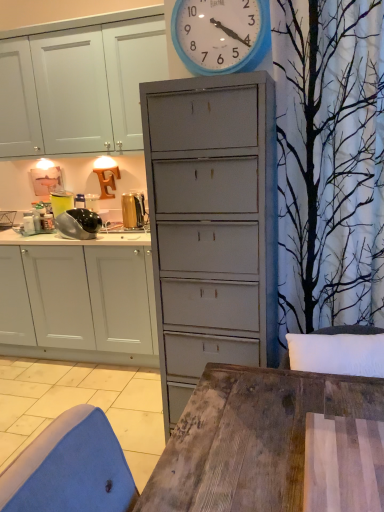
Question: Does gold metallic toaster at upper left, which is counted as the first appliance, starting from the right, appear on the left side of white matte cabinet at left?

Choices:
 (A) yes
 (B) no

Answer: (B)

Question: Considering the relative sizes of gold metallic toaster at upper left, acting as the 2th appliance starting from the left, and white matte cabinet at left in the image provided, is gold metallic toaster at upper left, acting as the 2th appliance starting from the left, wider than white matte cabinet at left?

Choices:
 (A) no
 (B) yes

Answer: (A)

Question: Does gold metallic toaster at upper left, acting as the 2th appliance starting from the left, come in front of white matte cabinet at left?

Choices:
 (A) no
 (B) yes

Answer: (A)

Question: From the image's perspective, is gold metallic toaster at upper left, acting as the 2th appliance starting from the left, on top of white matte cabinet at left?

Choices:
 (A) no
 (B) yes

Answer: (B)

Question: Does gold metallic toaster at upper left, which is counted as the first appliance, starting from the right, have a smaller size compared to white matte cabinet at left?

Choices:
 (A) no
 (B) yes

Answer: (B)

Question: Is gold metallic toaster at upper left, acting as the 2th appliance starting from the left, surrounding white matte cabinet at left?

Choices:
 (A) no
 (B) yes

Answer: (A)

Question: Can you confirm if gold metallic toaster at upper left, which is counted as the first appliance, starting from the right, is positioned to the right of blue plastic wall clock at upper center?

Choices:
 (A) no
 (B) yes

Answer: (A)

Question: Could blue plastic wall clock at upper center be considered to be inside gold metallic toaster at upper left, which is counted as the first appliance, starting from the right?

Choices:
 (A) no
 (B) yes

Answer: (A)

Question: From a real-world perspective, is gold metallic toaster at upper left, acting as the 2th appliance starting from the left, positioned under blue plastic wall clock at upper center based on gravity?

Choices:
 (A) no
 (B) yes

Answer: (B)

Question: Does gold metallic toaster at upper left, acting as the 2th appliance starting from the left, touch blue plastic wall clock at upper center?

Choices:
 (A) no
 (B) yes

Answer: (A)

Question: Does gold metallic toaster at upper left, which is counted as the first appliance, starting from the right, turn towards blue plastic wall clock at upper center?

Choices:
 (A) no
 (B) yes

Answer: (A)

Question: Are gold metallic toaster at upper left, acting as the 2th appliance starting from the left, and blue plastic wall clock at upper center located far from each other?

Choices:
 (A) no
 (B) yes

Answer: (B)

Question: Is blue plastic wall clock at upper center placed right next to shiny metallic food processor at left, which appears as the second appliance when viewed from the right?

Choices:
 (A) no
 (B) yes

Answer: (A)